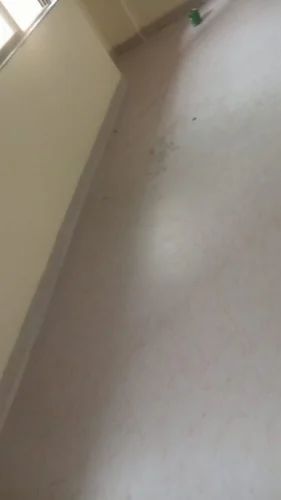
What are the coordinates of `floor` in the screenshot? It's located at click(123, 319), click(178, 156), click(148, 54).